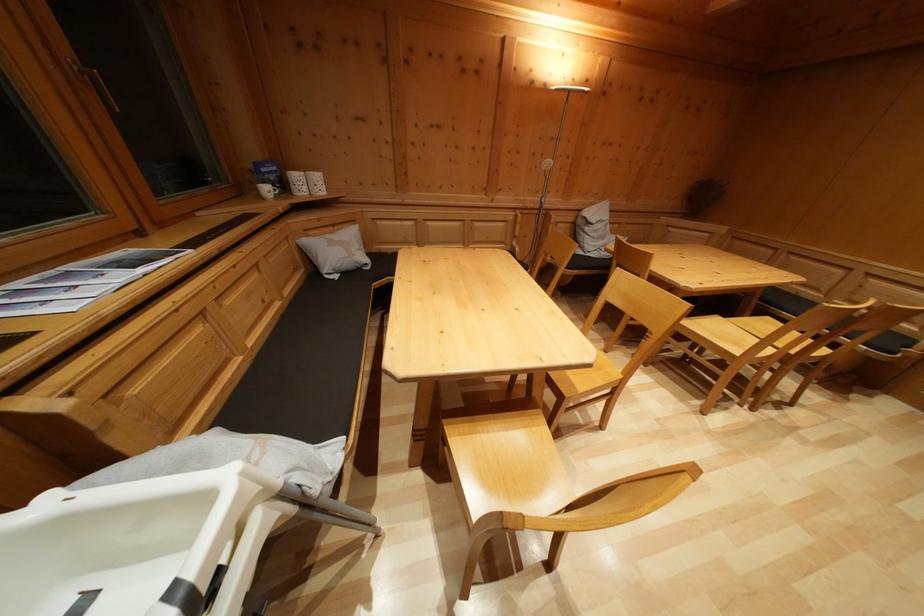
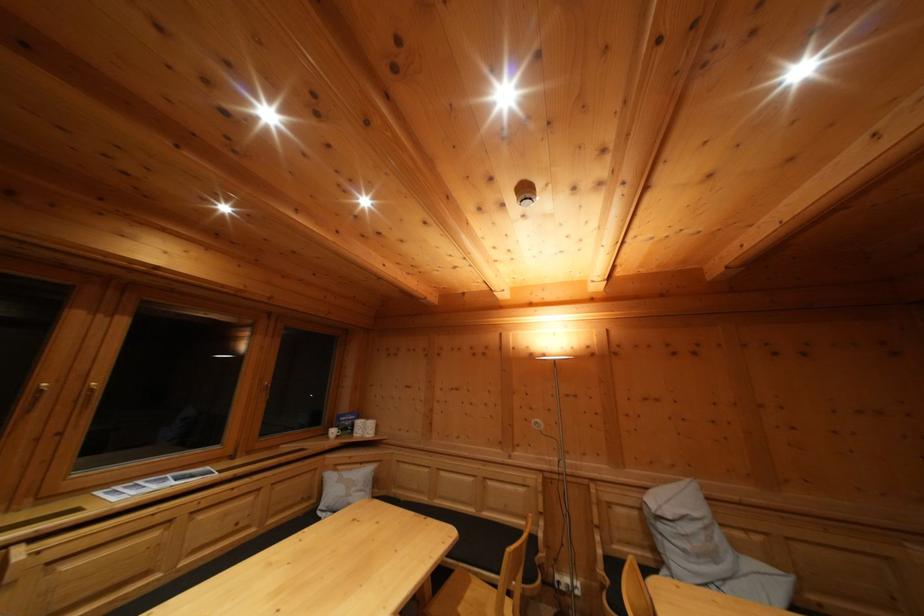
Locate, in the second image, the point that corresponds to pixel 338 233 in the first image.

(368, 469)